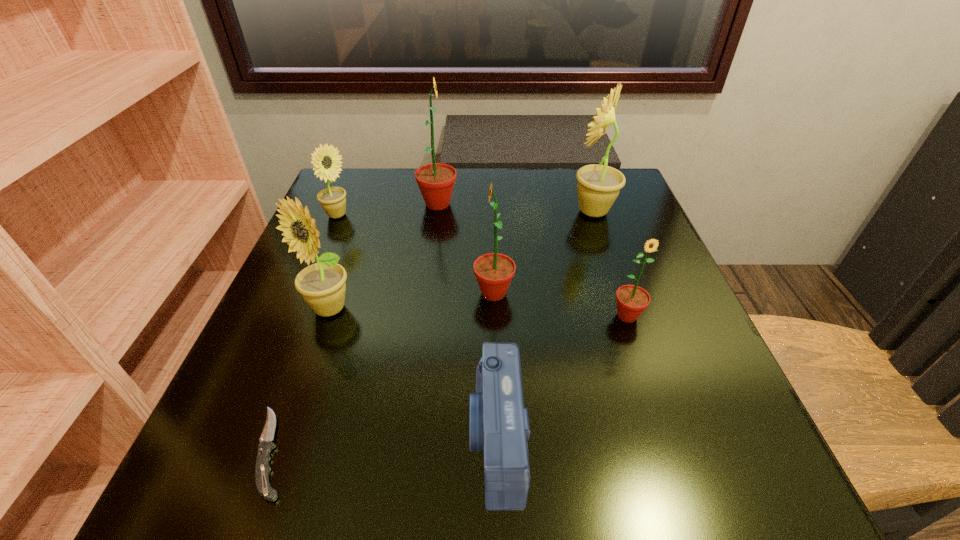
The width and height of the screenshot is (960, 540). Identify the location of free space located 0.180m on the lens of the second shortest object. [x=343, y=439].

Where is `blank area located 0.220m on the lens of the second shortest object`? blank area located 0.220m on the lens of the second shortest object is located at coordinates (314, 439).

This screenshot has width=960, height=540. Find the location of `free space located 0.370m on the lens of the second shortest object`. free space located 0.370m on the lens of the second shortest object is located at coordinates (208, 439).

This screenshot has height=540, width=960. I want to click on vacant space located 0.260m on the back of the shortest object, so click(x=331, y=289).

Find the location of a particular element. The width and height of the screenshot is (960, 540). camera positioned at the near edge is located at coordinates tap(499, 425).

Locate an element on the screen. pocketknife at the near edge is located at coordinates (262, 469).

What are the coordinates of `pocketknife that is at the left edge` in the screenshot? It's located at (262, 469).

Find the location of a particular element. The height and width of the screenshot is (540, 960). object present at the far left corner is located at coordinates (332, 199).

The image size is (960, 540). In order to click on object that is positioned at the near left corner in this screenshot , I will do `click(262, 469)`.

Where is `object present at the far right corner`? The image size is (960, 540). object present at the far right corner is located at coordinates (598, 186).